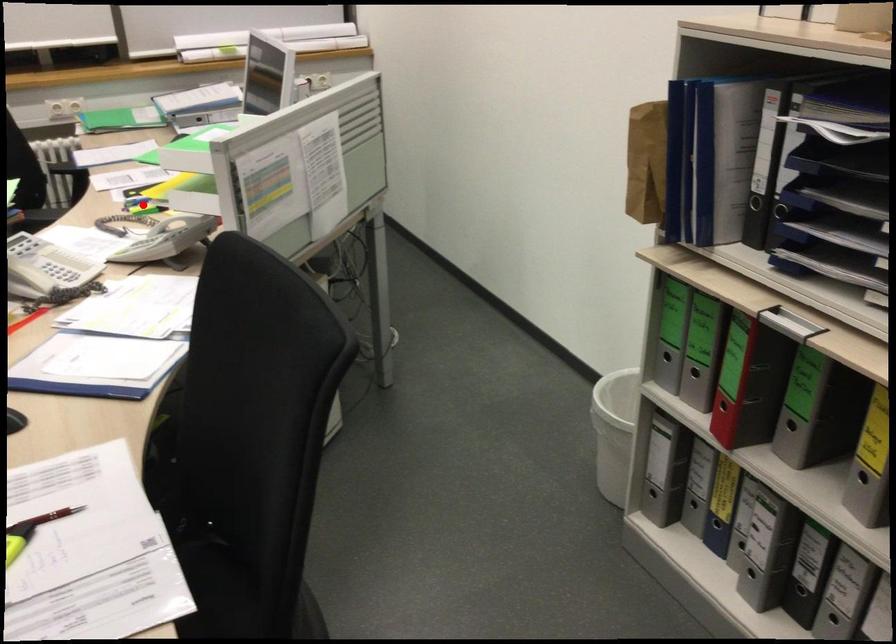
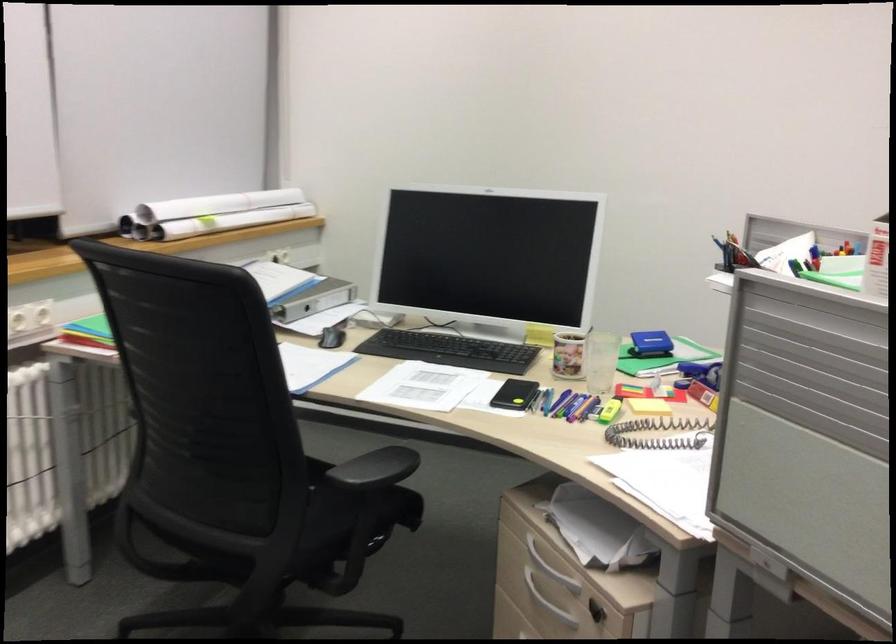
Question: I am providing you with two images of the same scene from different viewpoints. A red point is shown in image1. For the corresponding object point in image2, is it positioned nearer or farther from the camera?

Choices:
 (A) Nearer
 (B) Farther

Answer: (A)